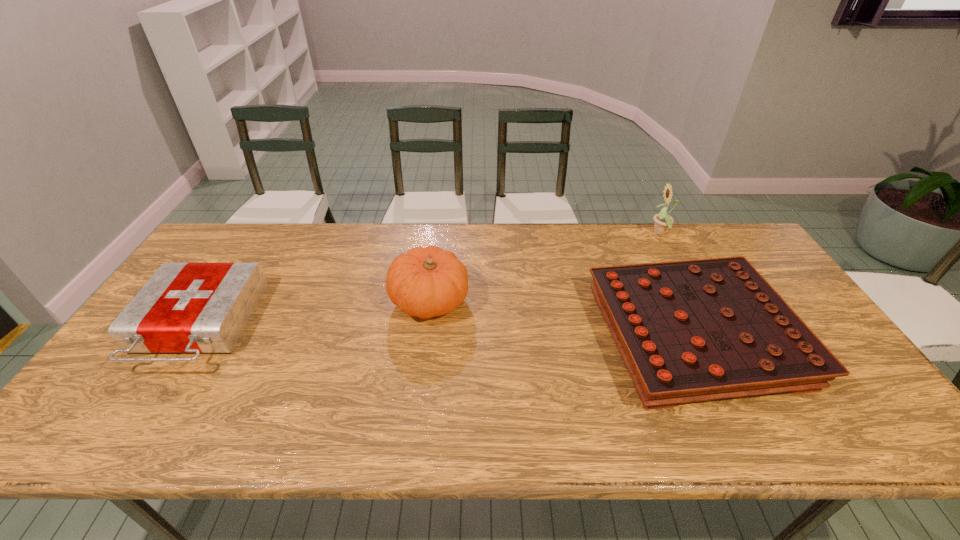
This screenshot has width=960, height=540. Find the location of `sunflower`. sunflower is located at coordinates (663, 221).

This screenshot has width=960, height=540. Find the location of `the tallest object`. the tallest object is located at coordinates (663, 221).

You are a GUI agent. You are given a task and a screenshot of the screen. Output one action in this format:
    pyautogui.click(x=<x>, y=<y>)
    Task: Click on the second object from left to right
    This screenshot has width=960, height=540.
    Given the screenshot: What is the action you would take?
    pyautogui.click(x=426, y=282)

I want to click on the third shortest object, so click(x=426, y=282).

I want to click on the leftmost object, so click(197, 308).

Locate an element on the screen. This screenshot has width=960, height=540. gameboard is located at coordinates (695, 330).

Where is `vacant space located 0.260m on the front-facing side of the sunflower`? vacant space located 0.260m on the front-facing side of the sunflower is located at coordinates (573, 233).

Identify the location of free space located on the front-facing side of the sunflower. (539, 233).

Identify the location of vacant space located on the front-facing side of the sunflower. The width and height of the screenshot is (960, 540). (579, 233).

Locate an element on the screen. The height and width of the screenshot is (540, 960). vacant space located 0.080m on the front of the second object from left to right is located at coordinates (423, 354).